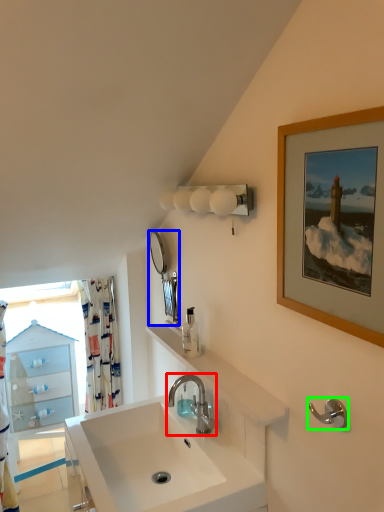
Question: Which object is positioned farthest from tap (highlighted by a red box)? Select from mirror (highlighted by a blue box) and towel bar (highlighted by a green box).

Choices:
 (A) mirror
 (B) towel bar

Answer: (B)